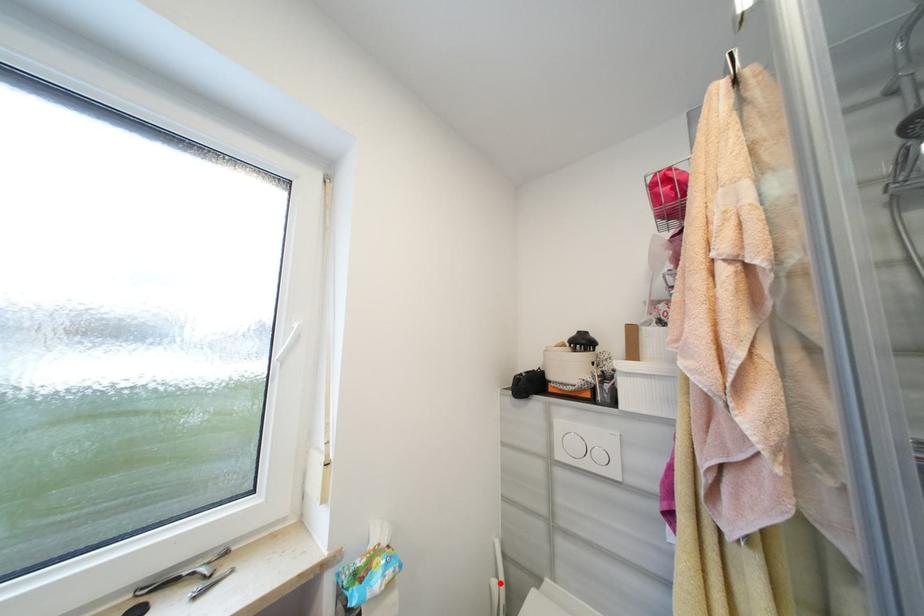
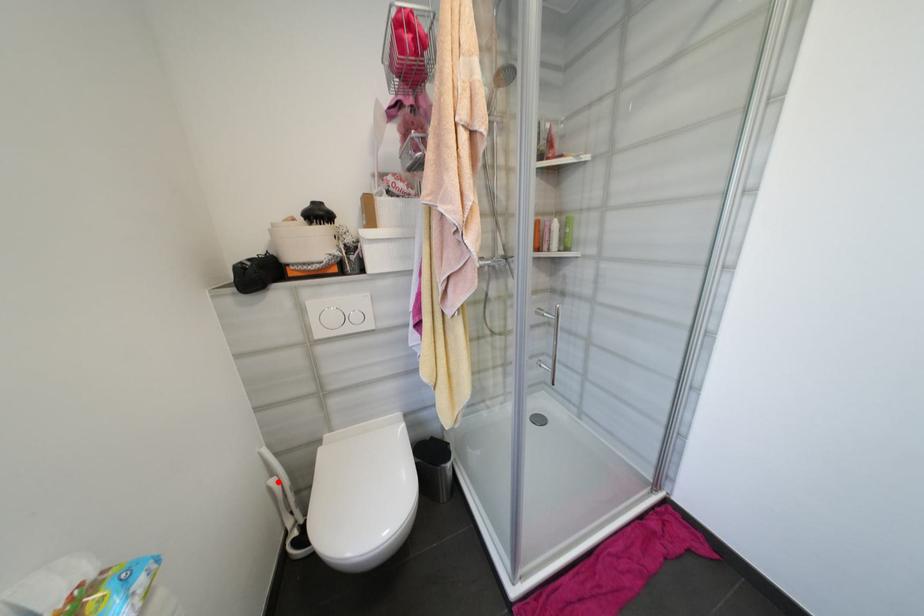
I am providing you with two images of the same scene from different viewpoints. A red point is marked on the first image and another point is marked on the second image. Are the points marked in image1 and image2 representing the same 3D position?

Yes